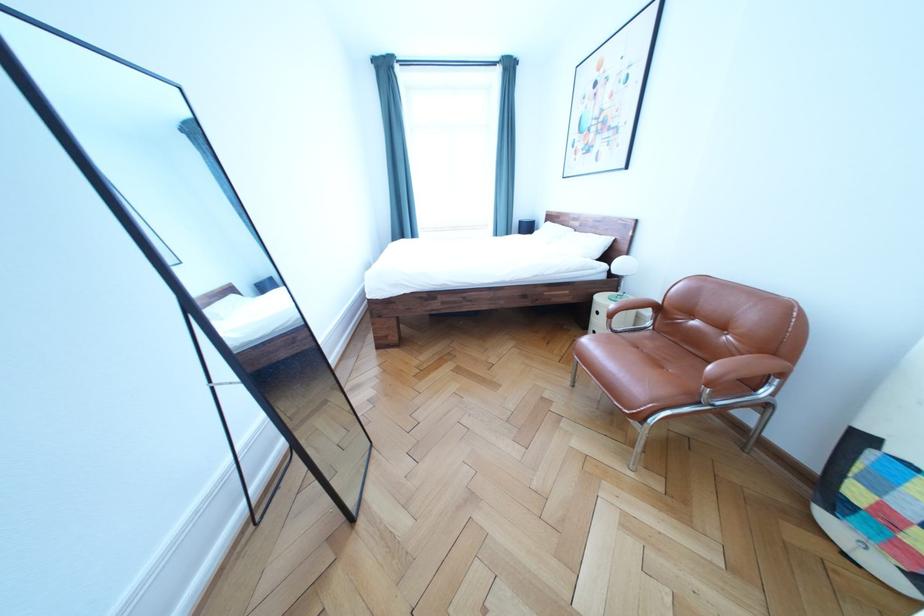
This screenshot has width=924, height=616. Describe the element at coordinates (602, 317) in the screenshot. I see `the nightstand drawer handle` at that location.